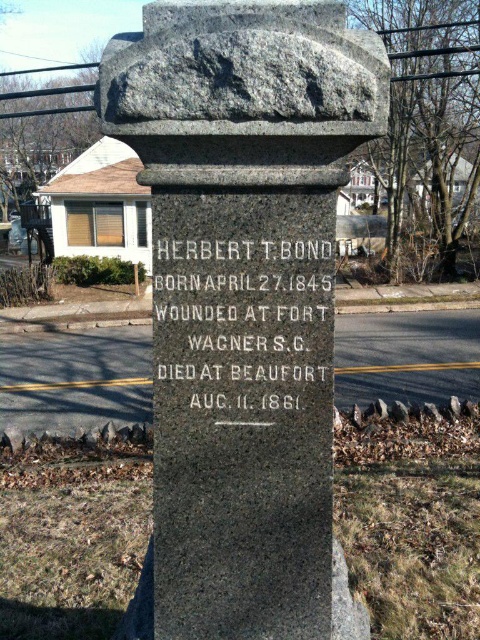
You are a historian examining the image of a memorial site. You notice two objects labeled granite stone monument at center and black granite stone at center. Based on their positions, which one is located higher up?

The black granite stone at center is higher up because the granite stone monument at center is positioned below it.

You are a tour guide leading a group and want to ensure everyone can read the engraving on the granite stone monument at center. The average person can read text from 1.5 meters away. Is the monument within a comfortable reading distance?

The granite stone monument at center is 1.59 meters away from the viewer, which is slightly beyond the average comfortable reading distance of 1.5 meters. The group may need to step closer for better readability.

You are a surveyor tasked with placing a new plaque on the granite stone monument at center. The plaque must be placed at coordinates that are exactly 0.05 units higher than the current monument. What are the coordinates where the plaque should be placed?

The granite stone monument at center is located at point [242,294]. To place the plaque exactly 0.05 units higher, the new coordinates would be [266,294].